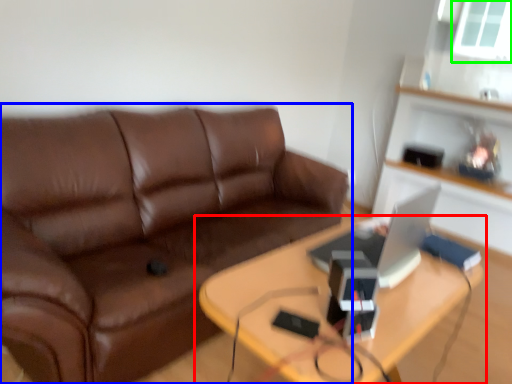
Question: Considering the real-world distances, which object is closest to table (highlighted by a red box)? studio couch (highlighted by a blue box) or window screen (highlighted by a green box).

Choices:
 (A) studio couch
 (B) window screen

Answer: (A)